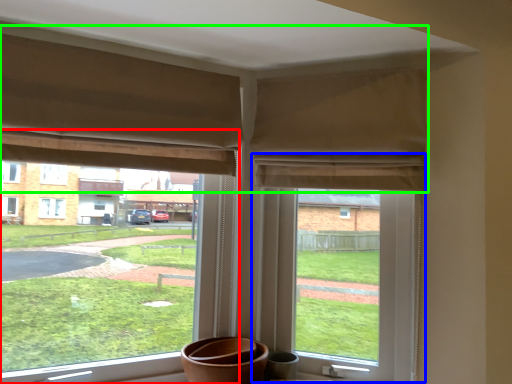
Question: Which object is the farthest from window (highlighted by a red box)? Choose among these: window screen (highlighted by a blue box) or curtain (highlighted by a green box).

Choices:
 (A) window screen
 (B) curtain

Answer: (B)